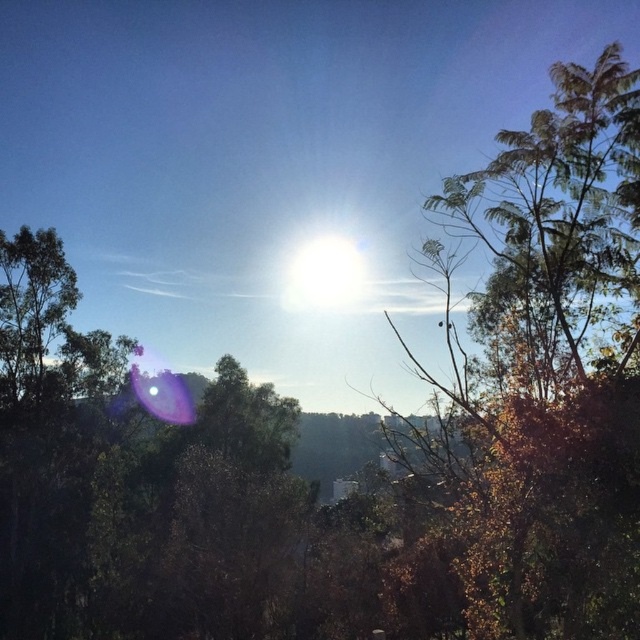
You are a photographer trying to capture the bright white sun at center while avoiding the green leafy tree at upper right. Based on their sizes and positions, can you suggest a way to frame the shot so the tree doesn

The green leafy tree at upper right is much taller than the bright white sun at center, so you can position the camera lower to ensure the tree doesn

You are a photographer trying to capture a shot of the bright white sun at center while avoiding the green leafy tree at upper right. Given that your camera lens has a 50mm focal length, can you estimate whether the tree will block the sun in your photo?

The distance between the green leafy tree at upper right and the bright white sun at center is 30.16 meters. Since the tree is 30.16 meters away from the sun, and the sun is at the center, the photographer can adjust the camera angle slightly to avoid the tree blocking the sun.

You are an astronomer observing the sky and want to take a photo of the bright white sun at center. However, there is a green leafy tree at upper right in the way. Can you adjust your position to avoid the tree while still capturing the sun?

The green leafy tree at upper right is closer to the viewer than the bright white sun at center. By moving your position to the left or right, you can shift the angle so that the tree no longer blocks the sun, as the tree is closer and can be moved out of the line of sight while keeping the sun in frame.